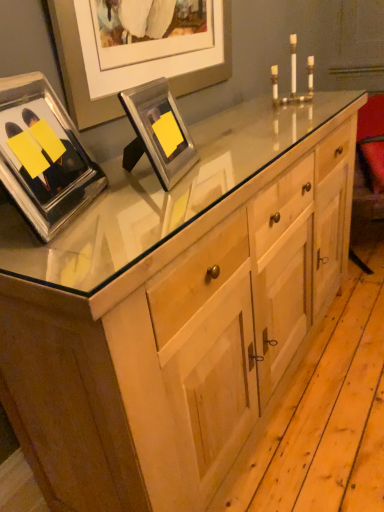
You are a GUI agent. You are given a task and a screenshot of the screen. Output one action in this format:
    pyautogui.click(x=<x>, y=<y>)
    Task: Click on the free spot to the left of gold metallic candle holder at upper center
    The image size is (384, 512).
    Given the screenshot: What is the action you would take?
    pyautogui.click(x=245, y=112)